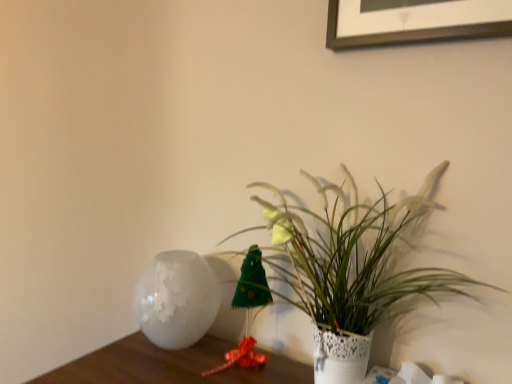
Question: From a real-world perspective, is white frosted vase at left physically located above or below white textured vase at center?

Choices:
 (A) below
 (B) above

Answer: (A)

Question: Looking at their shapes, would you say white frosted vase at left is wider or thinner than white textured vase at center?

Choices:
 (A) thin
 (B) wide

Answer: (B)

Question: Is white frosted vase at left in front of or behind white textured vase at center in the image?

Choices:
 (A) behind
 (B) front

Answer: (A)

Question: In terms of size, does white textured vase at center appear bigger or smaller than white frosted vase at left?

Choices:
 (A) big
 (B) small

Answer: (A)

Question: In terms of height, does white textured vase at center look taller or shorter compared to white frosted vase at left?

Choices:
 (A) short
 (B) tall

Answer: (B)

Question: Which is correct: white textured vase at center is inside white frosted vase at left, or outside of it?

Choices:
 (A) inside
 (B) outside

Answer: (B)

Question: From the image's perspective, relative to white frosted vase at left, is white textured vase at center above or below?

Choices:
 (A) above
 (B) below

Answer: (A)